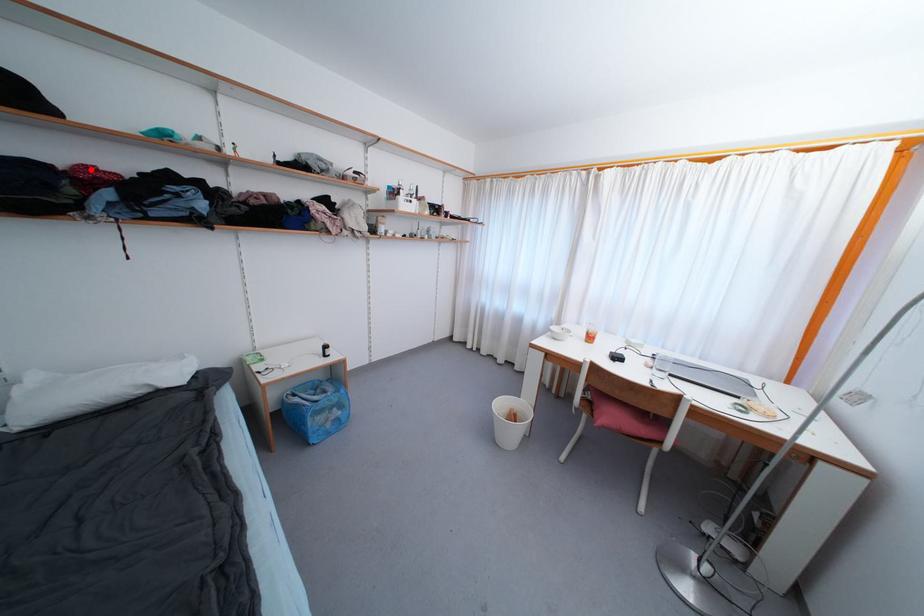
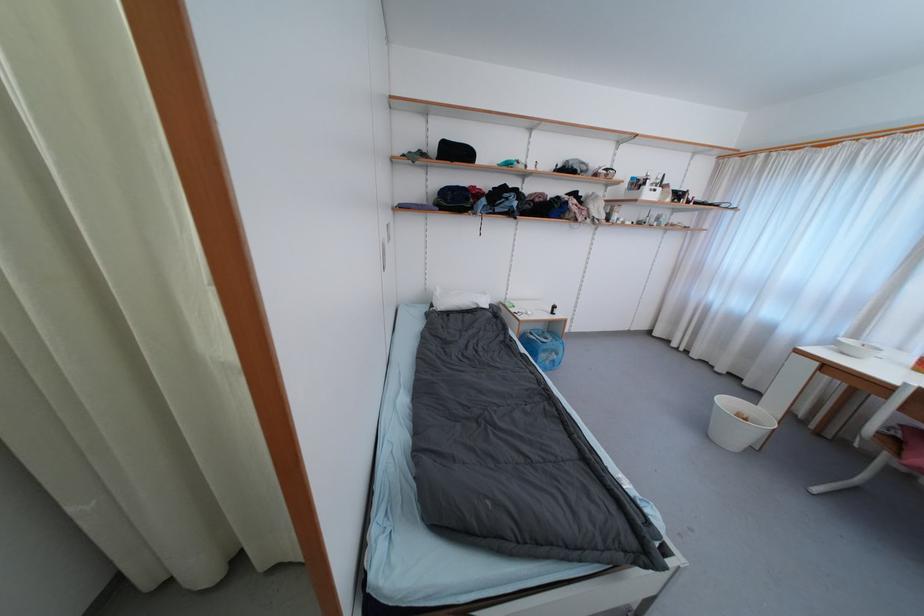
The point at the highlighted location is marked in the first image. Where is the corresponding point in the second image?

(478, 190)